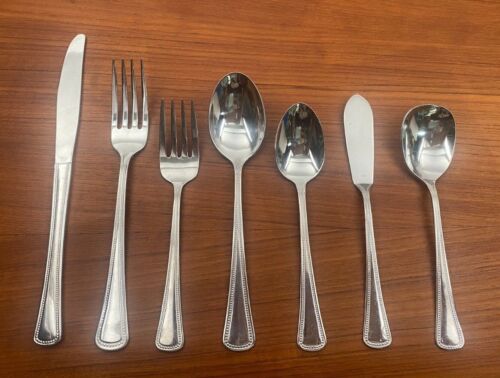
Locate an element on the screen. This screenshot has width=500, height=378. silverware is located at coordinates (59, 173), (118, 190), (179, 204), (301, 233), (241, 248), (374, 263), (452, 274).